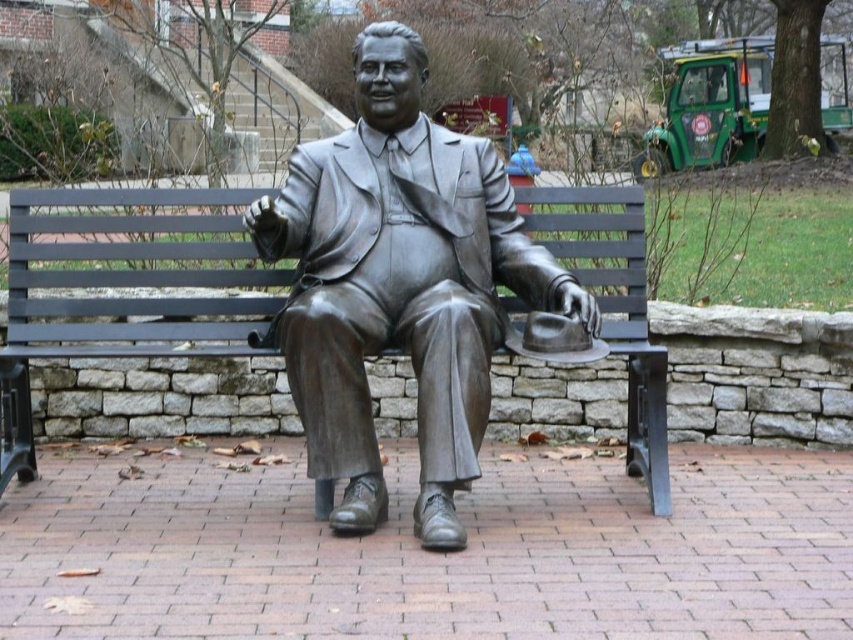
Which is above, bronze statue at center or black metal bench at center?

bronze statue at center

Does bronze statue at center have a lesser width compared to black metal bench at center?

No, bronze statue at center is not thinner than black metal bench at center.

The height and width of the screenshot is (640, 853). Find the location of `bronze statue at center`. bronze statue at center is located at coordinates click(399, 285).